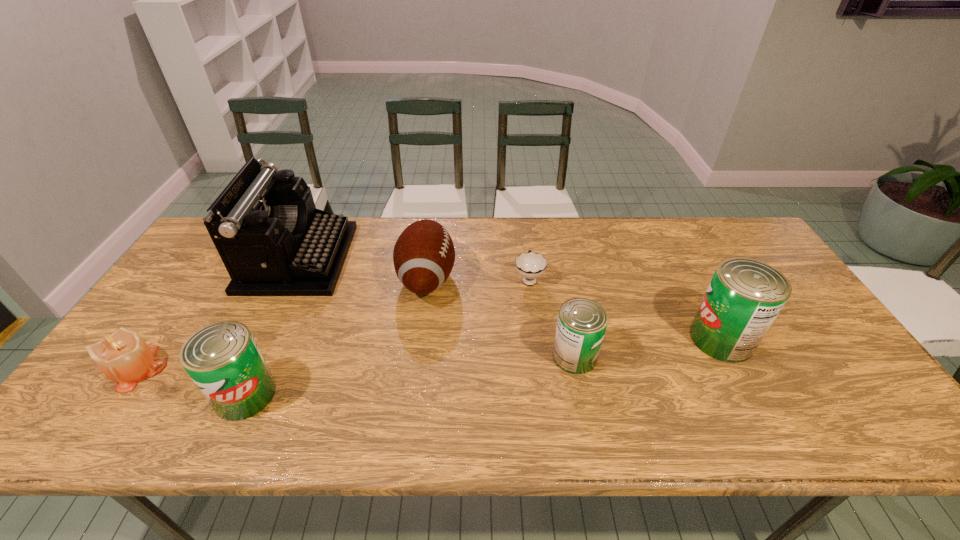
Identify the location of vacant space that's between the football and the second can from right to left. (501, 317).

At what (x,y) coordinates should I click in order to perform the action: click on free space between the cup and the leftmost object. Please return your answer as a coordinate pair (x, y). The image size is (960, 540). Looking at the image, I should click on (334, 323).

Find the location of a particular element. This screenshot has height=540, width=960. unoccupied area between the leftmost object and the typewriter is located at coordinates (219, 313).

Identify the location of object that is the closest to the rightmost can. This screenshot has height=540, width=960. (581, 325).

Where is `object that is the fifth closest one to the shortest can`? Image resolution: width=960 pixels, height=540 pixels. object that is the fifth closest one to the shortest can is located at coordinates (223, 360).

Choose which can is the second nearest neighbor to the candle. Please provide its 2D coordinates. Your answer should be formatted as a tuple, i.e. [(x, y)], where the tuple contains the x and y coordinates of a point satisfying the conditions above.

[(581, 325)]

You are a GUI agent. You are given a task and a screenshot of the screen. Output one action in this format:
    pyautogui.click(x=<x>, y=<y>)
    Task: Click on the can that is the closest to the fourth object from right to left
    The image size is (960, 540).
    Given the screenshot: What is the action you would take?
    pyautogui.click(x=581, y=325)

At what (x,y) coordinates should I click in order to perform the action: click on vacant space that satisfies the following two spatial constraints: 1. on the typing side of the tallest object; 2. on the left side of the rightmost can. Please return your answer as a coordinate pair (x, y). The width and height of the screenshot is (960, 540). Looking at the image, I should click on (259, 339).

Where is `free space that satisfies the following two spatial constraints: 1. on the typing side of the rightmost can; 2. on the right side of the typewriter`? The image size is (960, 540). free space that satisfies the following two spatial constraints: 1. on the typing side of the rightmost can; 2. on the right side of the typewriter is located at coordinates (259, 339).

The image size is (960, 540). Find the location of `vacant area in the image that satisfies the following two spatial constraints: 1. on the laces of the second can from right to left; 2. on the left side of the fourth object from right to left`. vacant area in the image that satisfies the following two spatial constraints: 1. on the laces of the second can from right to left; 2. on the left side of the fourth object from right to left is located at coordinates (417, 356).